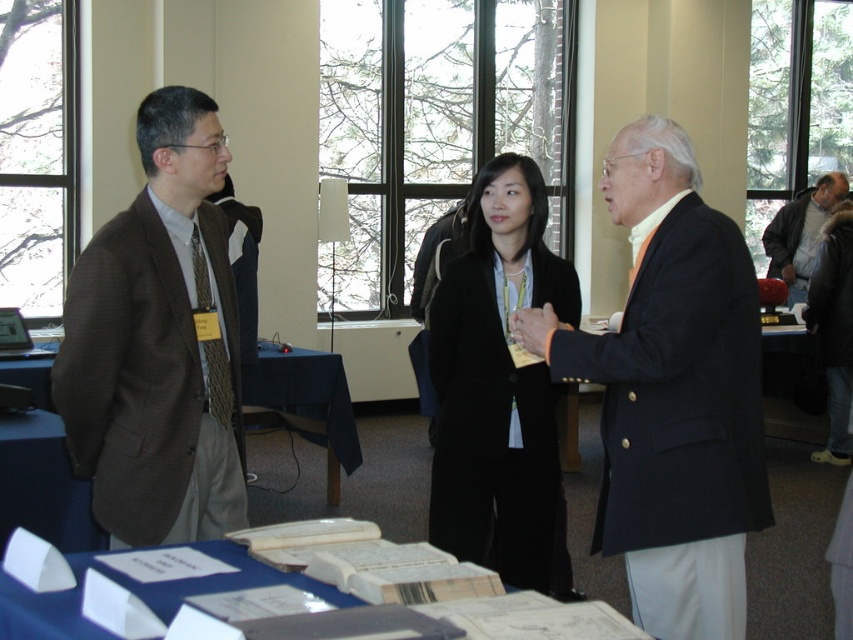
Question: Which of the following is the closest to the observer?

Choices:
 (A) (346, 467)
 (B) (569, 611)
 (C) (813, 252)
 (D) (685, 339)

Answer: (B)

Question: Which of these objects is positioned closest to the orange silk tie at center?

Choices:
 (A) black matte blazer at center
 (B) blue fabric table at lower center
 (C) blue fabric table at center

Answer: (A)

Question: Is the position of blue fabric table at center less distant than that of gray wool jacket at right?

Choices:
 (A) no
 (B) yes

Answer: (B)

Question: Is blue fabric table at lower center wider than gray wool jacket at right?

Choices:
 (A) no
 (B) yes

Answer: (B)

Question: Which object appears farthest from the camera in this image?

Choices:
 (A) brown textured blazer at left
 (B) gray wool jacket at right

Answer: (B)

Question: Where is black matte blazer at center located in relation to blue fabric table at center in the image?

Choices:
 (A) below
 (B) above

Answer: (B)